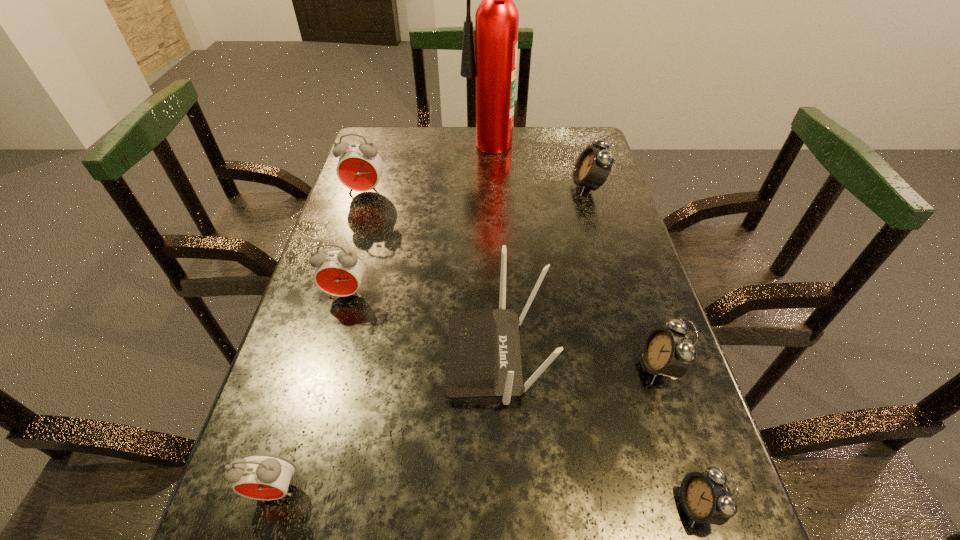
Find the location of a particular element. The width and height of the screenshot is (960, 540). vacant space that satisfies the following two spatial constraints: 1. at the nozzle of the fire extinguisher; 2. on the face of the farthest red alarm clock is located at coordinates (489, 192).

Locate an element on the screen. vacant space that satisfies the following two spatial constraints: 1. on the face of the fourth farthest alarm clock; 2. on the face of the nearest red alarm clock is located at coordinates (698, 490).

The width and height of the screenshot is (960, 540). I want to click on free point that satisfies the following two spatial constraints: 1. on the face of the farthest white alarm clock; 2. on the face of the tallest alarm clock, so click(x=589, y=192).

Find the location of `free location that satisfies the following two spatial constraints: 1. on the face of the farthest white alarm clock; 2. on the face of the nearest red alarm clock`. free location that satisfies the following two spatial constraints: 1. on the face of the farthest white alarm clock; 2. on the face of the nearest red alarm clock is located at coordinates (678, 490).